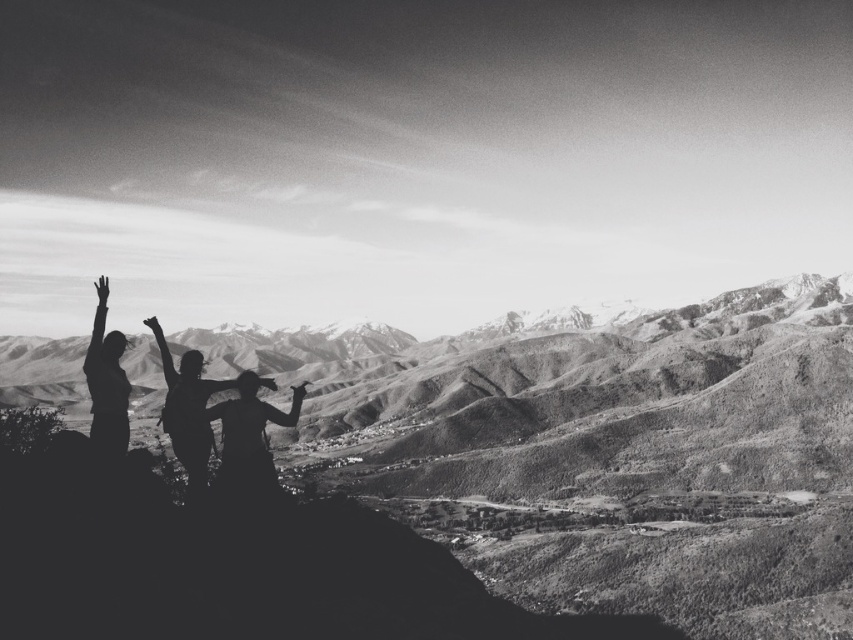
Does rugged stone mountain at center have a greater height compared to silvery metallic arm at upper left?

Correct, rugged stone mountain at center is much taller as silvery metallic arm at upper left.

Is point (775, 332) closer to camera compared to point (103, 284)?

No, (775, 332) is behind (103, 284).

The image size is (853, 640). Identify the location of rugged stone mountain at center. (460, 490).

Is point (519, 380) farther from viewer compared to point (299, 410)?

Yes, point (519, 380) is behind point (299, 410).

Which is above, rugged stone mountain at center or smooth skin arm at center?

rugged stone mountain at center

Find the location of `rugged stone mountain at center`. rugged stone mountain at center is located at coordinates (460, 490).

The height and width of the screenshot is (640, 853). Find the location of `rugged stone mountain at center`. rugged stone mountain at center is located at coordinates (460, 490).

Is white matte hand at upper left wider than black matte hand at center?

Yes.

Between white matte hand at upper left and black matte hand at center, which one is positioned higher?

Positioned higher is white matte hand at upper left.

Where is `white matte hand at upper left`? This screenshot has width=853, height=640. white matte hand at upper left is located at coordinates (102, 289).